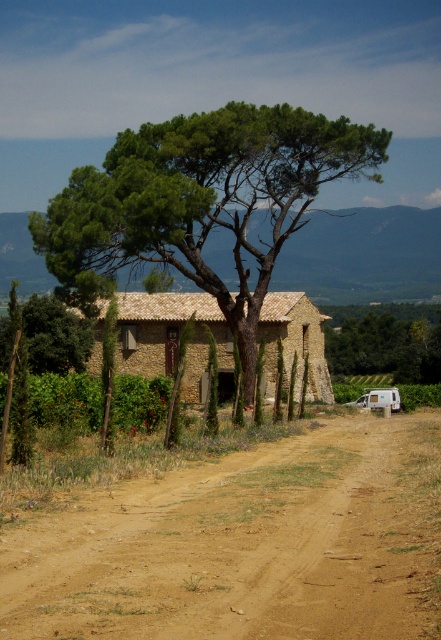
Question: From the image, what is the correct spatial relationship of green leafy tree at center in relation to brown stone house at center?

Choices:
 (A) above
 (B) below

Answer: (A)

Question: Can you confirm if green leafy tree at center is bigger than brown stone house at center?

Choices:
 (A) no
 (B) yes

Answer: (B)

Question: Considering the real-world distances, which object is closest to the green leafy tree at left?

Choices:
 (A) brown stone house at center
 (B) green leafy tree at center
 (C) brown dirt track at center

Answer: (A)

Question: Is green leafy tree at center positioned in front of green leafy tree at left?

Choices:
 (A) yes
 (B) no

Answer: (B)

Question: Which object is the closest to the brown dirt track at center?

Choices:
 (A) brown stone house at center
 (B) green leafy tree at upper center

Answer: (A)

Question: Which point is farther from the camera taking this photo?

Choices:
 (A) (59, 333)
 (B) (179, 292)
 (C) (354, 586)
 (D) (384, 365)

Answer: (D)